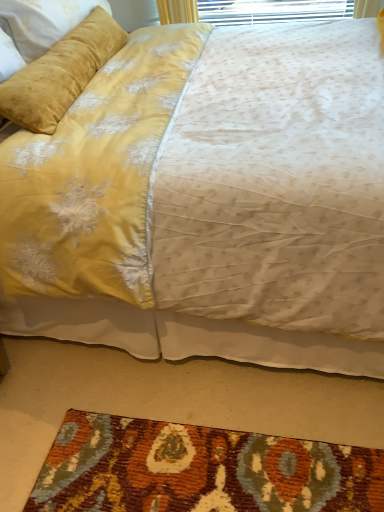
Where is `vacant region above textured wool mat at lower center (from a real-world perspective)`? This screenshot has height=512, width=384. vacant region above textured wool mat at lower center (from a real-world perspective) is located at coordinates (157, 429).